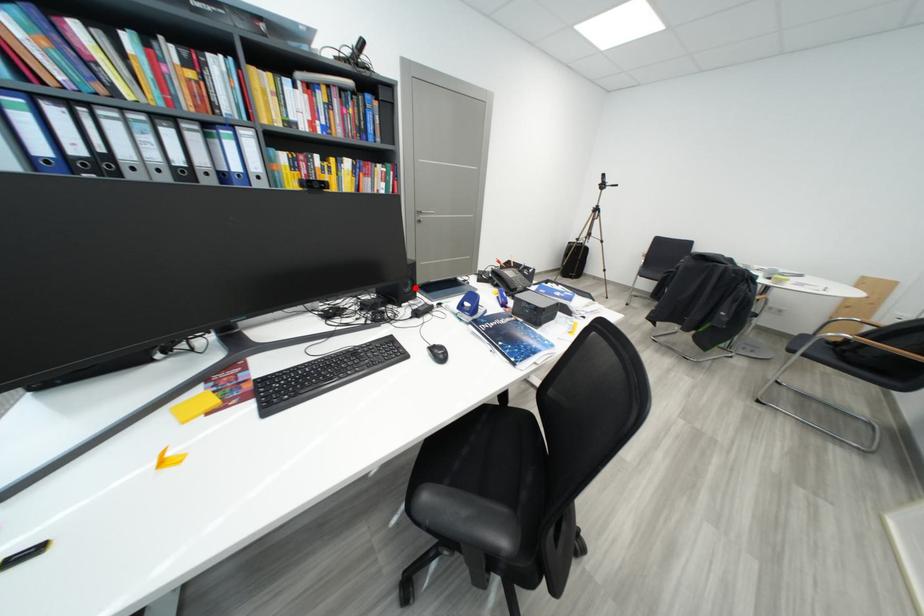
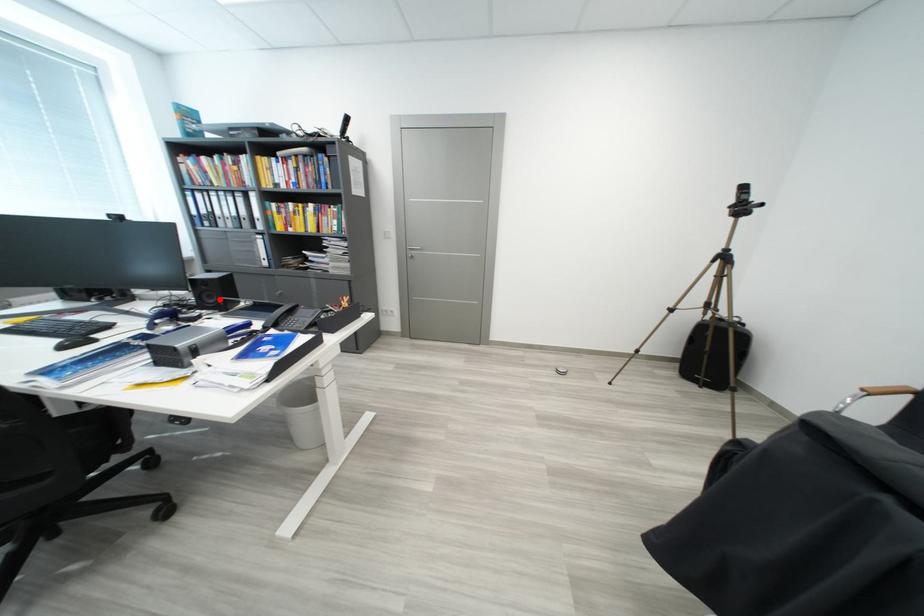
I am providing you with two images of the same scene from different viewpoints. A red point is marked on the first image and another point is marked on the second image. Is the red point in image1 aligned with the point shown in image2?

Yes